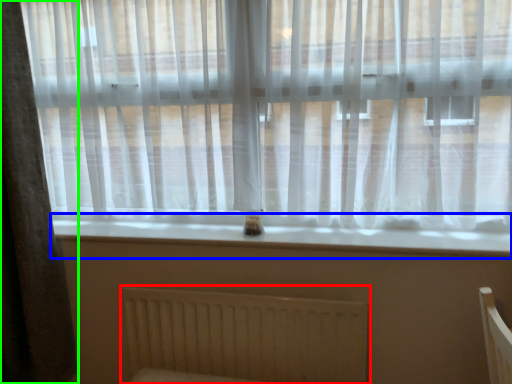
Question: Which object is positioned closest to radiator (highlighted by a red box)? Select from window sill (highlighted by a blue box) and curtain (highlighted by a green box).

Choices:
 (A) window sill
 (B) curtain

Answer: (A)